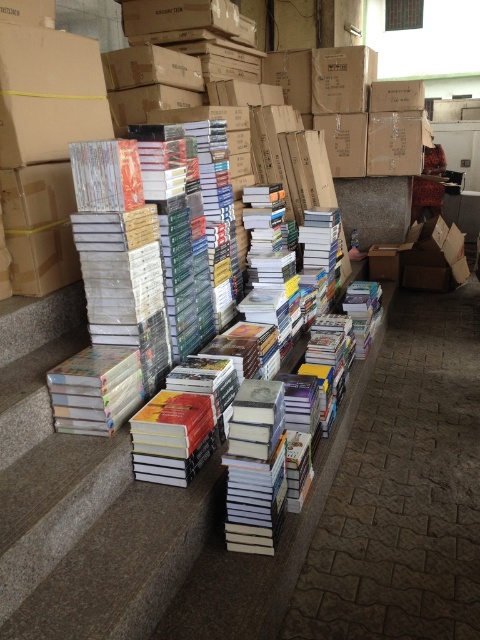
Consider the image. You are a warehouse worker who needs to retrieve an item from the matte brown cardboard box at upper left. You have a forklift that can reach up to 2 meters. Can you safely retrieve the item using the forklift?

The matte brown cardboard box at upper left is 1.95 meters away from the camera, which is within the forklifts 2 meter reach. Yes, you can safely retrieve the item using the forklift.

You are a delivery person who just arrived at the storage area. You need to place a new package at the exact coordinates where the matte brown cardboard box at upper left is located. What are the coordinates you should aim for?

The matte brown cardboard box at upper left is located at coordinates point (48, 93). You should aim for those coordinates to place the new package.

You are organizing items in the storage area and need to place a new box between the matte brown cardboard box at upper left and the brown cardboard box at center. Is there space available between them?

The matte brown cardboard box at upper left is to the left of the brown cardboard box at center, so there is space between them to place a new box.